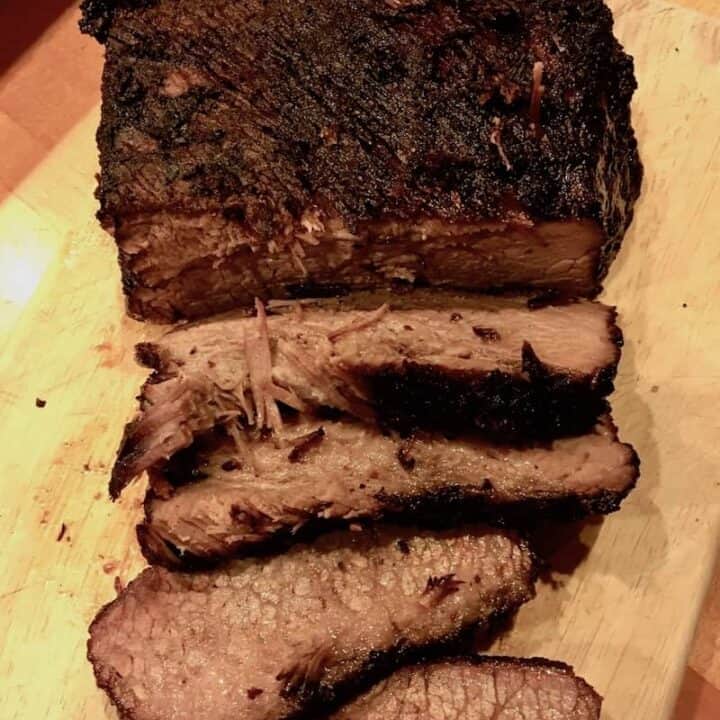
Find the location of a particular element. space beyond counter is located at coordinates (14, 36).